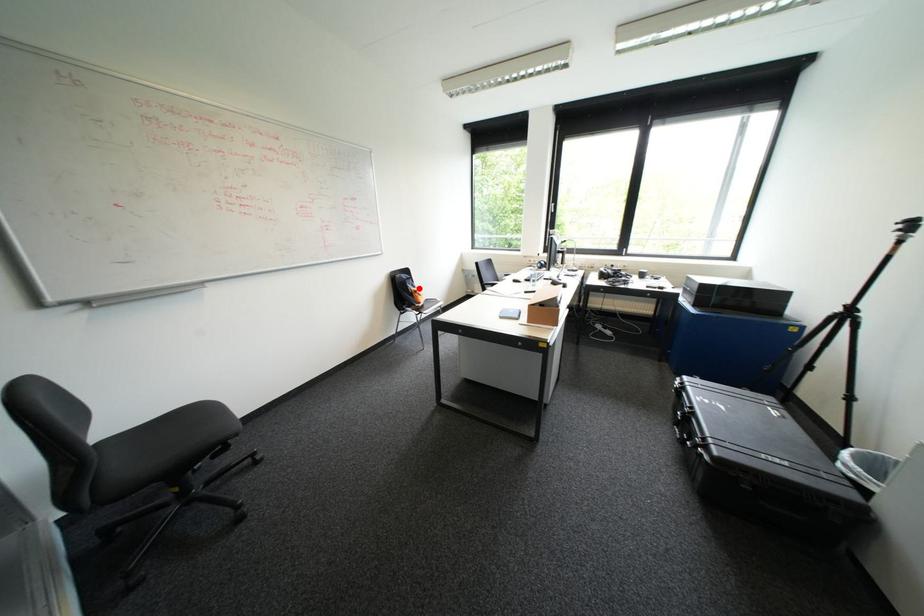
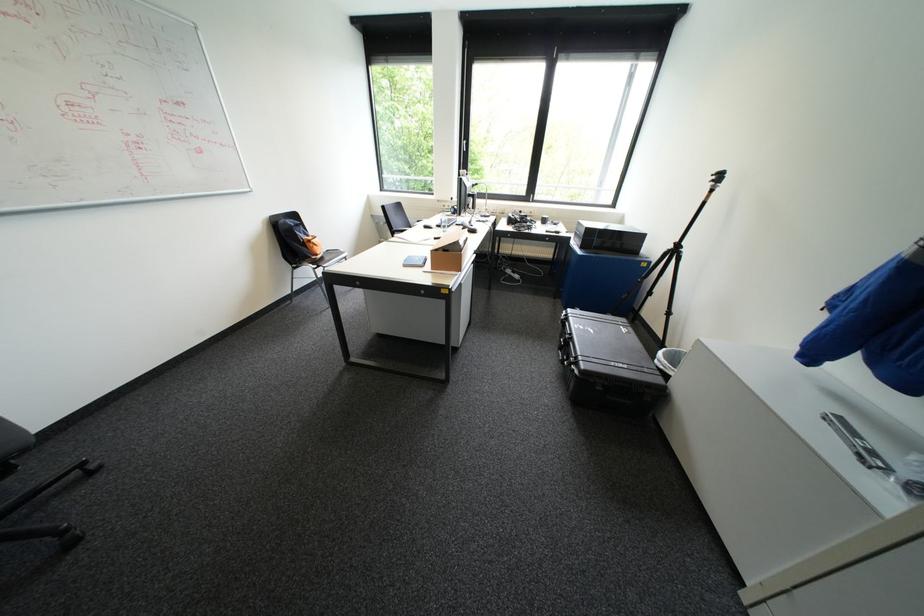
Locate, in the second image, the point that corresponds to the highlighted location in the first image.

(310, 237)